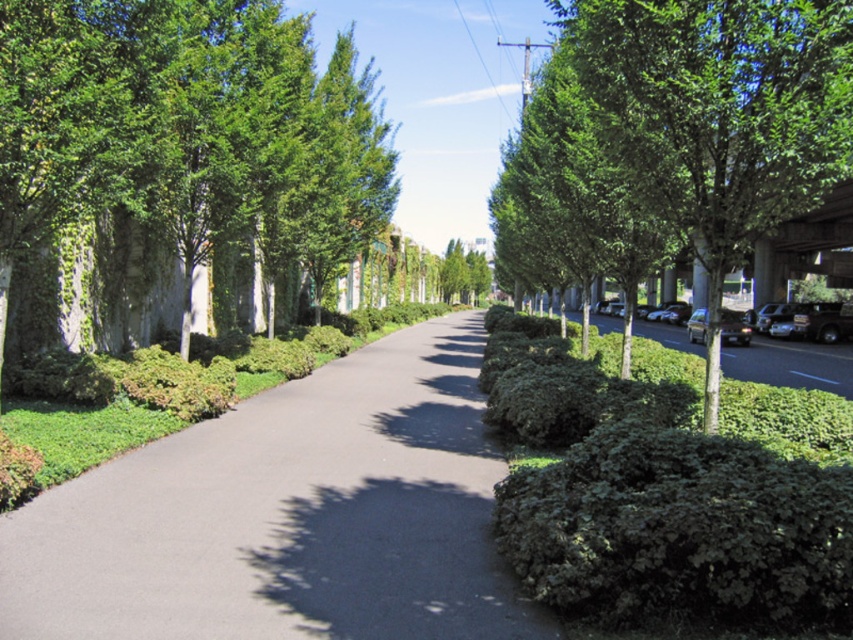
You are standing at the starting point of the pathway and want to reach the end. There are two points marked on your map as point 1 at coordinates point (229,4) and point 2 at coordinates point (740,321). Which point should you head towards first if you want to reach the end of the pathway as quickly as possible?

You should head towards point (229,4) first because it is in front of point (740,321) along the pathway, so reaching it first would place you closer to the end of the pathway.

You are a pedestrian standing on the pathway and want to cross to the road on the right. From your current position, which object is closer to you, the green leafy tree at right or the shiny black sedan at right?

The green leafy tree at right is closer to you since it is in front of the shiny black sedan at right.

You are a delivery person carrying a package and need to cross the pathway between the green leafy tree at right and the shiny black sedan at right. The package is fragile and requires a clear path of at least 8 meters to avoid any obstacles. Can you safely move the package through this area?

The distance between the green leafy tree at right and the shiny black sedan at right is 7.53 meters, which is less than the required 8 meters. Therefore, you cannot safely move the package through this area without risking damage due to insufficient clearance.